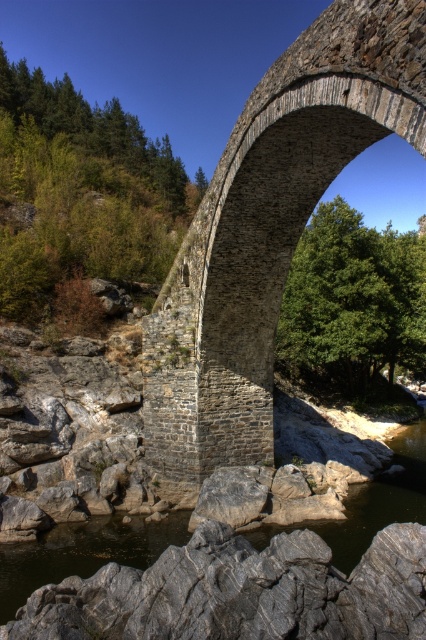
Question: Is stone textured arch bridge at center thinner than gray stone river at lower center?

Choices:
 (A) no
 (B) yes

Answer: (B)

Question: Which object is closer to the camera taking this photo?

Choices:
 (A) stone textured arch bridge at center
 (B) gray stone river at lower center

Answer: (A)

Question: Does stone textured arch bridge at center have a lesser width compared to gray stone river at lower center?

Choices:
 (A) yes
 (B) no

Answer: (A)

Question: Which of the following is the closest to the observer?

Choices:
 (A) gray stone river at lower center
 (B) stone textured arch bridge at center

Answer: (B)

Question: Does stone textured arch bridge at center have a smaller size compared to gray stone river at lower center?

Choices:
 (A) yes
 (B) no

Answer: (B)